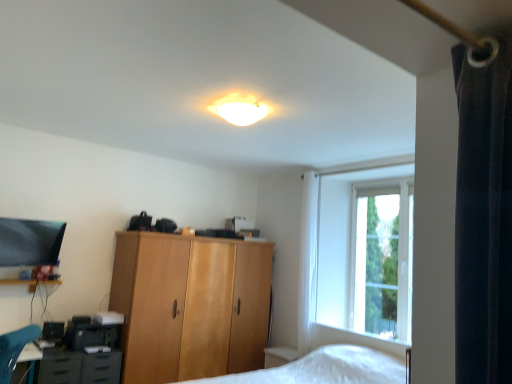
The height and width of the screenshot is (384, 512). Identify the location of white fabric curtain at center. (307, 261).

What do you see at coordinates (190, 306) in the screenshot? I see `wooden cabinet at center` at bounding box center [190, 306].

Identify the location of matte black drawer at lower left. This screenshot has height=384, width=512. point(59,367).

Identify the location of white fabric curtain at center. The image size is (512, 384). (307, 261).

Which of these two, matte brown cabinet at lower left or wooden cabinet at center, is wider?

Wider between the two is wooden cabinet at center.

From the image's perspective, relative to wooden cabinet at center, is matte brown cabinet at lower left above or below?

Based on their image positions, matte brown cabinet at lower left is located beneath wooden cabinet at center.

Which object is further away from the camera taking this photo, matte brown cabinet at lower left or wooden cabinet at center?

wooden cabinet at center is behind.

Is matte brown cabinet at lower left aimed at wooden cabinet at center?

No, matte brown cabinet at lower left is not oriented towards wooden cabinet at center.

From a real-world perspective, is clear glass window at upper right located higher than wooden cabinet at center?

Yes, from a real-world perspective, clear glass window at upper right is above wooden cabinet at center.

Who is more distant, clear glass window at upper right or wooden cabinet at center?

clear glass window at upper right is more distant.

Find the location of a particular element. The image size is (512, 384). window screen located behind the wooden cabinet at center is located at coordinates (382, 261).

In the image, is clear glass window at upper right on the left side or the right side of wooden cabinet at center?

clear glass window at upper right is positioned on wooden cabinet at center's right side.

Is point (404, 240) less distant than point (311, 252)?

Yes, it is.

From the image's perspective, which one is positioned higher, clear glass window at upper right or white fabric curtain at center?

From the image's view, clear glass window at upper right is above.

Can you tell me how much clear glass window at upper right and white fabric curtain at center differ in facing direction?

The facing directions of clear glass window at upper right and white fabric curtain at center are 1.04 degrees apart.

At what (x,y) coordinates should I click in order to perform the action: click on window screen in front of the white fabric curtain at center. Please return your answer as a coordinate pair (x, y). Image resolution: width=512 pixels, height=384 pixels. Looking at the image, I should click on (382, 261).

From a real-world perspective, is white fabric curtain at center above or below matte black drawer at lower left?

white fabric curtain at center is above matte black drawer at lower left.

Is white fabric curtain at center at the right side of matte black drawer at lower left?

Yes, white fabric curtain at center is to the right of matte black drawer at lower left.

Is white fabric curtain at center thinner than matte black drawer at lower left?

Yes, white fabric curtain at center is thinner than matte black drawer at lower left.

Where is `curtain located on the right of matte black drawer at lower left`? This screenshot has width=512, height=384. curtain located on the right of matte black drawer at lower left is located at coordinates (307, 261).

From the image's perspective, which one is positioned lower, wooden cabinet at center or matte brown cabinet at lower left?

matte brown cabinet at lower left, from the image's perspective.

Can you tell me how much wooden cabinet at center and matte brown cabinet at lower left differ in facing direction?

9.35e-05 degrees separate the facing orientations of wooden cabinet at center and matte brown cabinet at lower left.

Is matte brown cabinet at lower left at the back of wooden cabinet at center?

No, wooden cabinet at center is not facing the opposite direction of matte brown cabinet at lower left.

Relative to matte brown cabinet at lower left, is wooden cabinet at center in front or behind?

Visually, wooden cabinet at center is located behind matte brown cabinet at lower left.

Between matte white ceiling light at upper center and white fabric curtain at center, which one has larger size?

white fabric curtain at center.

Looking at their sizes, would you say matte white ceiling light at upper center is wider or thinner than white fabric curtain at center?

In the image, matte white ceiling light at upper center appears to be wider than white fabric curtain at center.

The width and height of the screenshot is (512, 384). I want to click on curtain that appears below the matte white ceiling light at upper center (from the image's perspective), so click(x=307, y=261).

In the scene shown: From the image's perspective, is wooden cabinet at center located above white fabric curtain at center?

No.

Choose the correct answer: Is wooden cabinet at center inside white fabric curtain at center or outside it?

wooden cabinet at center exists outside the volume of white fabric curtain at center.

Based on their sizes in the image, would you say wooden cabinet at center is bigger or smaller than white fabric curtain at center?

Clearly, wooden cabinet at center is larger in size than white fabric curtain at center.

Find the location of a particular element. curtain on the right of wooden cabinet at center is located at coordinates (307, 261).

At what (x,y) coordinates should I click in order to perform the action: click on cupboard to the right of matte brown cabinet at lower left. Please return your answer as a coordinate pair (x, y). The width and height of the screenshot is (512, 384). Looking at the image, I should click on (190, 306).

You are a GUI agent. You are given a task and a screenshot of the screen. Output one action in this format:
    pyautogui.click(x=<x>, y=<y>)
    Task: Click on the cupboard that appears below the clear glass window at upper right (from the image's perspective)
    The height and width of the screenshot is (384, 512).
    Given the screenshot: What is the action you would take?
    pyautogui.click(x=190, y=306)

When comparing their distances from matte white ceiling light at upper center, does matte brown cabinet at lower left or clear glass window at upper right seem closer?

clear glass window at upper right is positioned closer to the anchor matte white ceiling light at upper center.

Looking at the image, which one is located further to matte brown cabinet at lower left, matte white ceiling light at upper center or wooden cabinet at center?

matte white ceiling light at upper center.

Based on the photo, estimate the real-world distances between objects in this image. Which object is further from matte brown cabinet at lower left, wooden cabinet at center or matte black drawer at lower left?

wooden cabinet at center is further to matte brown cabinet at lower left.

From the image, which object appears to be farther from matte white ceiling light at upper center, clear glass window at upper right or matte brown cabinet at lower left?

matte brown cabinet at lower left lies further to matte white ceiling light at upper center than the other object.

Considering their positions, is wooden cabinet at center positioned closer to matte white ceiling light at upper center than matte black drawer at lower left?

Based on the image, wooden cabinet at center appears to be nearer to matte white ceiling light at upper center.

Estimate the real-world distances between objects in this image. Which object is closer to white fabric curtain at center, matte black drawer at lower left or wooden cabinet at center?

Based on the image, wooden cabinet at center appears to be nearer to white fabric curtain at center.

Looking at the image, which one is located further to wooden cabinet at center, matte white ceiling light at upper center or white fabric curtain at center?

matte white ceiling light at upper center is positioned further to the anchor wooden cabinet at center.

Estimate the real-world distances between objects in this image. Which object is closer to clear glass window at upper right, wooden cabinet at center or white fabric curtain at center?

white fabric curtain at center.

In order to click on cabinetry between matte black drawer at lower left and wooden cabinet at center in the horizontal direction in this screenshot , I will do `click(78, 367)`.

Where is `cupboard between matte brown cabinet at lower left and white fabric curtain at center from left to right`? cupboard between matte brown cabinet at lower left and white fabric curtain at center from left to right is located at coordinates (190, 306).

You are a GUI agent. You are given a task and a screenshot of the screen. Output one action in this format:
    pyautogui.click(x=<x>, y=<y>)
    Task: Click on the lamp situated between matte brown cabinet at lower left and clear glass window at upper right from left to right
    This screenshot has width=512, height=384.
    Given the screenshot: What is the action you would take?
    pyautogui.click(x=239, y=109)

This screenshot has width=512, height=384. I want to click on curtain located between matte black drawer at lower left and clear glass window at upper right in the left-right direction, so click(307, 261).